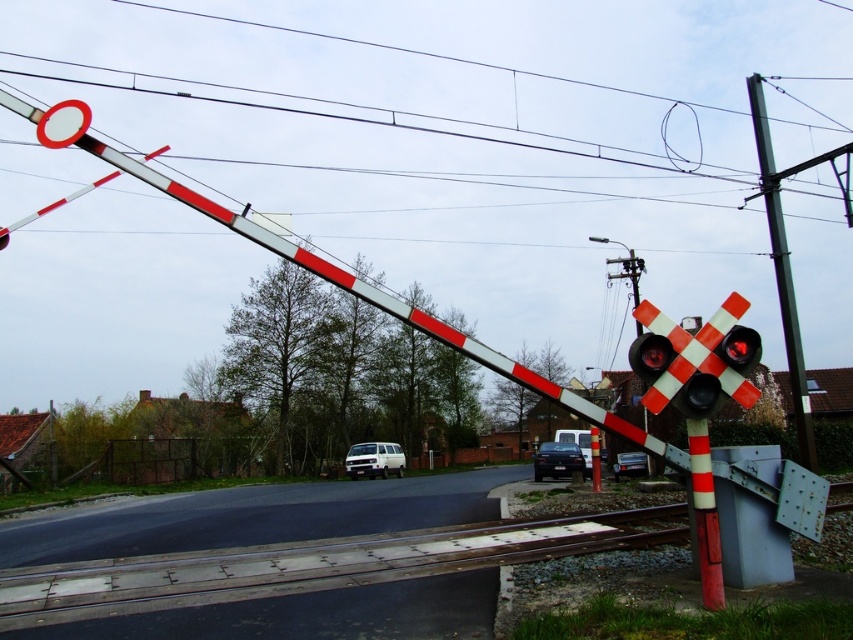
Does metallic gray pole at upper right have a greater width compared to white glossy circle at upper left?

Yes.

Who is taller, metallic gray pole at upper right or white glossy circle at upper left?

metallic gray pole at upper right is taller.

Identify the location of metallic gray pole at upper right. (782, 275).

Locate an element on the screen. The image size is (853, 640). metallic gray pole at upper right is located at coordinates (782, 275).

Based on the photo, does white matte van at center appear on the left side of metallic black car at center?

Yes, white matte van at center is to the left of metallic black car at center.

Is white matte van at center positioned before metallic black car at center?

No, white matte van at center is further to the viewer.

Is point (373, 445) positioned before point (535, 467)?

That is False.

The height and width of the screenshot is (640, 853). In order to click on white matte van at center in this screenshot , I will do `click(374, 460)`.

Measure the distance between smooth metal train track at center and white glossy circle at upper left.

smooth metal train track at center is 5.99 meters from white glossy circle at upper left.

Which is in front, point (32, 598) or point (74, 122)?

Positioned in front is point (74, 122).

Where is `smooth metal train track at center`? The image size is (853, 640). smooth metal train track at center is located at coordinates (308, 564).